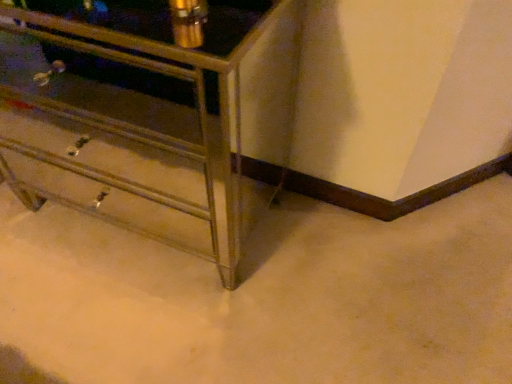
At what (x,y) coordinates should I click in order to perform the action: click on vacant area that is in front of metallic mirrored chest of drawers at lower left. Please return your answer as a coordinate pair (x, y). This screenshot has height=384, width=512. Looking at the image, I should click on (137, 319).